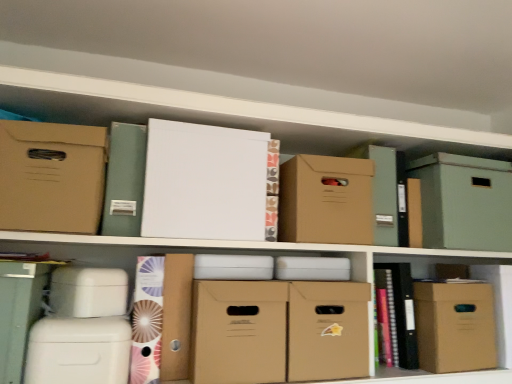
Question: From the image's perspective, is green cardboard box at upper right, the sixth cardboard box viewed from the left, above matte cardboard box at lower right?

Choices:
 (A) no
 (B) yes

Answer: (B)

Question: Is green cardboard box at upper right, which is the second cardboard box in right-to-left order, closer to camera compared to matte cardboard box at lower right?

Choices:
 (A) no
 (B) yes

Answer: (A)

Question: Is green cardboard box at upper right, the sixth cardboard box viewed from the left, behind matte cardboard box at lower right?

Choices:
 (A) no
 (B) yes

Answer: (B)

Question: Can you confirm if green cardboard box at upper right, which is the second cardboard box in right-to-left order, is wider than matte cardboard box at lower right?

Choices:
 (A) yes
 (B) no

Answer: (A)

Question: Is green cardboard box at upper right, which is the second cardboard box in right-to-left order, facing away from matte cardboard box at lower right?

Choices:
 (A) no
 (B) yes

Answer: (A)

Question: From the image's perspective, is green cardboard box at upper right, the sixth cardboard box viewed from the left, positioned above or below matte brown cardboard box at upper center, placed as the 5th cardboard box when sorted from left to right?

Choices:
 (A) below
 (B) above

Answer: (A)

Question: Considering the positions of green cardboard box at upper right, the sixth cardboard box viewed from the left, and matte brown cardboard box at upper center, placed as the 5th cardboard box when sorted from left to right, in the image, is green cardboard box at upper right, the sixth cardboard box viewed from the left, taller or shorter than matte brown cardboard box at upper center, placed as the 5th cardboard box when sorted from left to right,?

Choices:
 (A) short
 (B) tall

Answer: (B)

Question: Would you say green cardboard box at upper right, the sixth cardboard box viewed from the left, is to the left or to the right of matte brown cardboard box at upper center, placed as the 5th cardboard box when sorted from left to right, in the picture?

Choices:
 (A) left
 (B) right

Answer: (B)

Question: Looking at their shapes, would you say green cardboard box at upper right, which is the second cardboard box in right-to-left order, is wider or thinner than matte brown cardboard box at upper center, acting as the 3th cardboard box starting from the right?

Choices:
 (A) wide
 (B) thin

Answer: (B)

Question: In terms of height, does matte green file at upper left, the first book from the top, look taller or shorter compared to matte brown cardboard box at lower right, the first cardboard box viewed from the right?

Choices:
 (A) tall
 (B) short

Answer: (B)

Question: From a real-world perspective, relative to matte brown cardboard box at lower right, which is the 7th cardboard box from left to right, is matte green file at upper left, the first book from the top, vertically above or below?

Choices:
 (A) below
 (B) above

Answer: (B)

Question: Looking at the image, does matte green file at upper left, which is counted as the second book, starting from the bottom, seem bigger or smaller compared to matte brown cardboard box at lower right, the first cardboard box viewed from the right?

Choices:
 (A) big
 (B) small

Answer: (B)

Question: Do you think matte green file at upper left, which is counted as the second book, starting from the bottom, is within matte brown cardboard box at lower right, which is the 7th cardboard box from left to right, or outside of it?

Choices:
 (A) outside
 (B) inside

Answer: (A)

Question: From the image's perspective, is matte brown cardboard box at upper center, placed as the 5th cardboard box when sorted from left to right, located above or below matte brown cardboard box at center, marked as the third cardboard box in a left-to-right arrangement?

Choices:
 (A) above
 (B) below

Answer: (A)

Question: Is point (291, 236) closer or farther from the camera than point (284, 360)?

Choices:
 (A) farther
 (B) closer

Answer: (A)